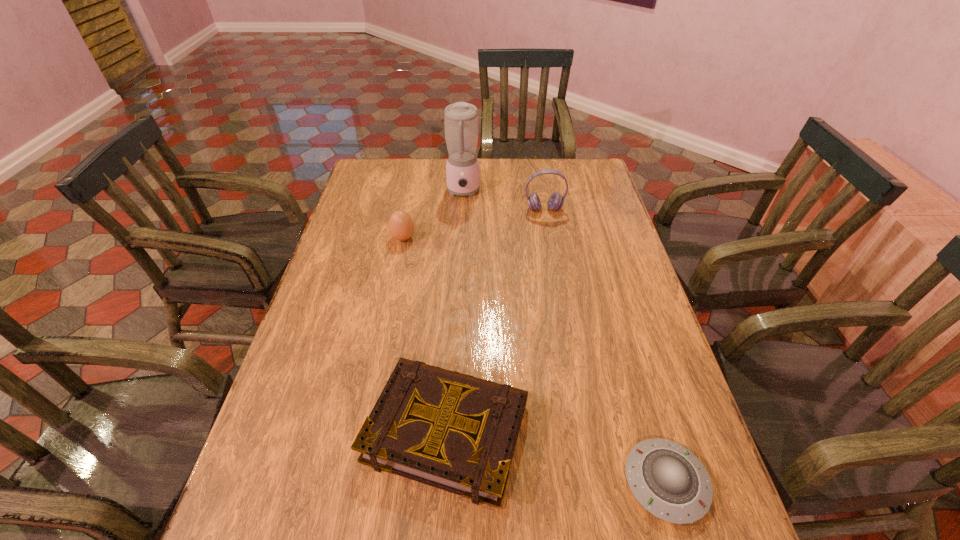
Choose which object is the nearest neighbor to the saucer. Please provide its 2D coordinates. Your answer should be formatted as a tuple, i.e. [(x, y)], where the tuple contains the x and y coordinates of a point satisfying the conditions above.

[(453, 431)]

This screenshot has height=540, width=960. What are the coordinates of `vacant space that satisfies the following two spatial constraints: 1. on the headband and ear cups of the headset; 2. on the right side of the saucer` in the screenshot? It's located at (593, 482).

The height and width of the screenshot is (540, 960). I want to click on vacant region that satisfies the following two spatial constraints: 1. on the base of the farthest object near the control knob; 2. on the right side of the shortest object, so click(x=449, y=482).

This screenshot has width=960, height=540. Identify the location of free space that satisfies the following two spatial constraints: 1. on the base of the tallest object near the control knob; 2. on the left side of the shortest object. (449, 482).